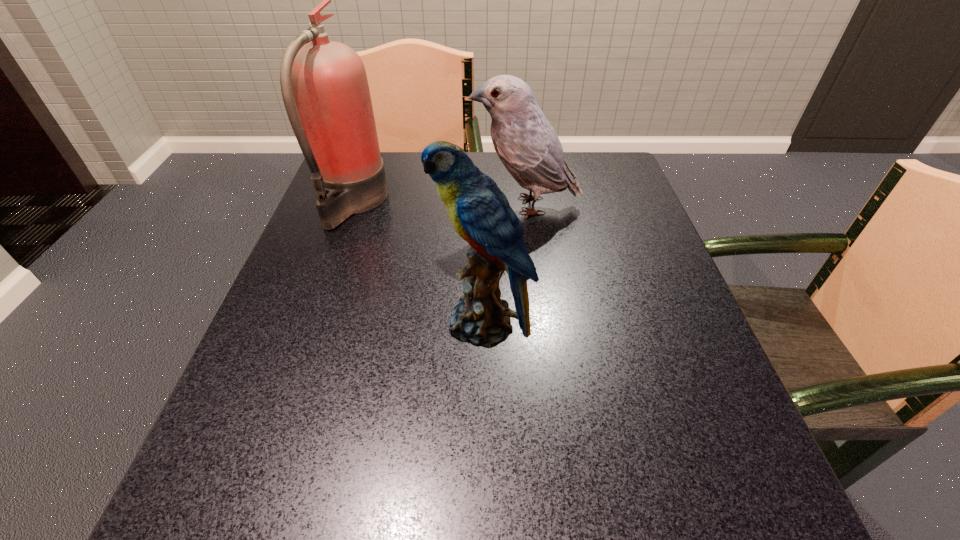
At what (x,y) coordinates should I click in order to perform the action: click on free region located 0.190m on the front-facing side of the farther parrot. Please return your answer as a coordinate pair (x, y). The width and height of the screenshot is (960, 540). Looking at the image, I should click on (390, 206).

Find the location of a particular element. fire extinguisher situated at the far edge is located at coordinates (333, 121).

Locate an element on the screen. The width and height of the screenshot is (960, 540). parrot at the far edge is located at coordinates (524, 140).

This screenshot has width=960, height=540. I want to click on object at the left edge, so click(x=333, y=121).

The image size is (960, 540). In order to click on object located at the right edge in this screenshot , I will do `click(524, 140)`.

Image resolution: width=960 pixels, height=540 pixels. Find the location of `object positioned at the far left corner`. object positioned at the far left corner is located at coordinates (x=333, y=121).

The width and height of the screenshot is (960, 540). Find the location of `object located in the far right corner section of the desktop`. object located in the far right corner section of the desktop is located at coordinates (524, 140).

I want to click on vacant space at the far edge of the desktop, so click(412, 170).

You are a GUI agent. You are given a task and a screenshot of the screen. Output one action in this format:
    pyautogui.click(x=<x>, y=<y>)
    Task: Click on the vacant area at the left edge of the desktop
    The image size is (960, 540).
    Given the screenshot: What is the action you would take?
    pyautogui.click(x=355, y=264)

Find the location of a particular element. This screenshot has height=540, width=960. vacant space at the right edge of the desktop is located at coordinates (650, 320).